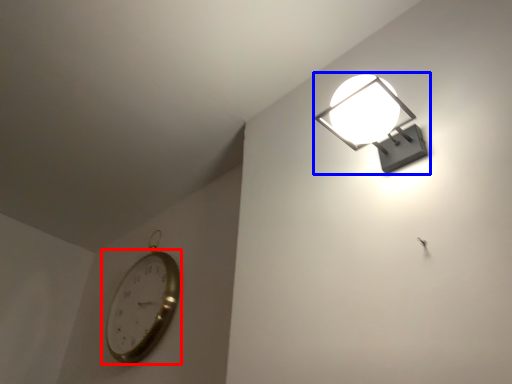
Question: Which point is further to the camera, wall clock (highlighted by a red box) or lamp (highlighted by a blue box)?

Choices:
 (A) wall clock
 (B) lamp

Answer: (A)